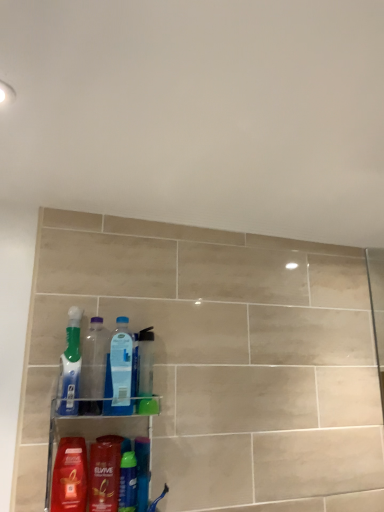
Describe the element at coordinates (119, 371) in the screenshot. I see `transparent plastic bottle at center, marked as the second bottle in a left-to-right arrangement` at that location.

Measure the distance between translucent plastic bottles at lower center and camera.

They are 1.09 meters apart.

This screenshot has width=384, height=512. What do you see at coordinates (70, 366) in the screenshot?
I see `translucent plastic toothbrush at left, positioned as the first cleaning product in top-to-bottom order` at bounding box center [70, 366].

What do you see at coordinates (70, 476) in the screenshot? The height and width of the screenshot is (512, 384). I see `shiny red shampoo at lower left, which appears as the second cleaning product when viewed from the top` at bounding box center [70, 476].

Measure the distance between translucent plastic mouthwash at lower center, placed as the second mouthwash when sorted from right to left, and camera.

A distance of 3.57 feet exists between translucent plastic mouthwash at lower center, placed as the second mouthwash when sorted from right to left, and camera.

Locate an element on the screen. The image size is (384, 512). translucent plastic bottle at lower center is located at coordinates (128, 482).

In the image, is shiny red shampoo at lower left, which appears as the second cleaning product when viewed from the top, positioned in front of or behind transparent plastic bottle at center, marked as the second bottle in a left-to-right arrangement?

shiny red shampoo at lower left, which appears as the second cleaning product when viewed from the top, is positioned closer to the viewer than transparent plastic bottle at center, marked as the second bottle in a left-to-right arrangement.

Considering the sizes of shiny red shampoo at lower left, which appears as the second cleaning product when viewed from the top, and transparent plastic bottle at center, positioned as the first bottle in right-to-left order, in the image, is shiny red shampoo at lower left, which appears as the second cleaning product when viewed from the top, wider or thinner than transparent plastic bottle at center, positioned as the first bottle in right-to-left order,?

Clearly, shiny red shampoo at lower left, which appears as the second cleaning product when viewed from the top, has more width compared to transparent plastic bottle at center, positioned as the first bottle in right-to-left order.

Considering the sizes of objects shiny red shampoo at lower left, which ranks as the first cleaning product in bottom-to-top order, and transparent plastic bottle at center, marked as the second bottle in a left-to-right arrangement, in the image provided, who is smaller, shiny red shampoo at lower left, which ranks as the first cleaning product in bottom-to-top order, or transparent plastic bottle at center, marked as the second bottle in a left-to-right arrangement,?

With smaller size is transparent plastic bottle at center, marked as the second bottle in a left-to-right arrangement.

Is shiny red shampoo at lower left, which appears as the second cleaning product when viewed from the top, oriented away from transparent plastic bottle at center, marked as the second bottle in a left-to-right arrangement?

No, shiny red shampoo at lower left, which appears as the second cleaning product when viewed from the top, is not facing away from transparent plastic bottle at center, marked as the second bottle in a left-to-right arrangement.

From the image's perspective, which is below, translucent plastic bottle at lower center or transparent plastic bottle at center, placed as the first bottle when sorted from left to right?

From the image's view, translucent plastic bottle at lower center is below.

Is translucent plastic bottle at lower center to the right of transparent plastic bottle at center, placed as the first bottle when sorted from left to right, from the viewer's perspective?

Yes, translucent plastic bottle at lower center is to the right of transparent plastic bottle at center, placed as the first bottle when sorted from left to right.

Considering the relative sizes of translucent plastic bottle at lower center and transparent plastic bottle at center, placed as the first bottle when sorted from left to right, in the image provided, is translucent plastic bottle at lower center shorter than transparent plastic bottle at center, placed as the first bottle when sorted from left to right,?

Yes.

From a real-world perspective, is translucent plastic bottle at lower center located higher than transparent plastic bottle at center, marked as the 2th bottle in a right-to-left arrangement?

Incorrect, from a real-world perspective, translucent plastic bottle at lower center is lower than transparent plastic bottle at center, marked as the 2th bottle in a right-to-left arrangement.

Is transparent plastic bottle at center, placed as the first bottle when sorted from left to right, not inside green plastic mouthwash at lower center, which appears as the 2th mouthwash when viewed from the left?

That's correct, transparent plastic bottle at center, placed as the first bottle when sorted from left to right, is outside of green plastic mouthwash at lower center, which appears as the 2th mouthwash when viewed from the left.

Can you confirm if transparent plastic bottle at center, placed as the first bottle when sorted from left to right, is positioned to the left of green plastic mouthwash at lower center, which appears as the 2th mouthwash when viewed from the left?

Indeed, transparent plastic bottle at center, placed as the first bottle when sorted from left to right, is positioned on the left side of green plastic mouthwash at lower center, which appears as the 2th mouthwash when viewed from the left.

From a real-world perspective, which object stands above the other?

transparent plastic bottle at center, placed as the first bottle when sorted from left to right.

What's the angular difference between shiny red shampoo at lower left, which ranks as the first cleaning product in bottom-to-top order, and translucent plastic toothbrush at left, positioned as the first cleaning product in top-to-bottom order,'s facing directions?

They differ by 0.000894 degrees in their facing directions.

Does shiny red shampoo at lower left, which ranks as the first cleaning product in bottom-to-top order, lie behind translucent plastic toothbrush at left, which is counted as the 2th cleaning product, starting from the bottom?

No, it is in front of translucent plastic toothbrush at left, which is counted as the 2th cleaning product, starting from the bottom.

Is shiny red shampoo at lower left, which ranks as the first cleaning product in bottom-to-top order, wider or thinner than translucent plastic toothbrush at left, which is counted as the 2th cleaning product, starting from the bottom?

In the image, shiny red shampoo at lower left, which ranks as the first cleaning product in bottom-to-top order, appears to be more narrow than translucent plastic toothbrush at left, which is counted as the 2th cleaning product, starting from the bottom.

From the image's perspective, is shiny red shampoo at lower left, which ranks as the first cleaning product in bottom-to-top order, positioned above or below translucent plastic toothbrush at left, positioned as the first cleaning product in top-to-bottom order?

shiny red shampoo at lower left, which ranks as the first cleaning product in bottom-to-top order, is below translucent plastic toothbrush at left, positioned as the first cleaning product in top-to-bottom order.

Based on the photo, is transparent plastic bottle at center, positioned as the first bottle in right-to-left order, with transparent plastic bottle at center, marked as the 2th bottle in a right-to-left arrangement?

Indeed, transparent plastic bottle at center, positioned as the first bottle in right-to-left order, and transparent plastic bottle at center, marked as the 2th bottle in a right-to-left arrangement, are beside each other and touching.

From a real-world perspective, is transparent plastic bottle at center, marked as the second bottle in a left-to-right arrangement, physically located above or below transparent plastic bottle at center, marked as the 2th bottle in a right-to-left arrangement?

From a real-world perspective, transparent plastic bottle at center, marked as the second bottle in a left-to-right arrangement, is physically below transparent plastic bottle at center, marked as the 2th bottle in a right-to-left arrangement.

Considering the sizes of transparent plastic bottle at center, positioned as the first bottle in right-to-left order, and transparent plastic bottle at center, placed as the first bottle when sorted from left to right, in the image, is transparent plastic bottle at center, positioned as the first bottle in right-to-left order, bigger or smaller than transparent plastic bottle at center, placed as the first bottle when sorted from left to right,?

transparent plastic bottle at center, positioned as the first bottle in right-to-left order, is bigger than transparent plastic bottle at center, placed as the first bottle when sorted from left to right.

Is transparent plastic bottle at center, positioned as the first bottle in right-to-left order, facing towards transparent plastic bottle at center, marked as the 2th bottle in a right-to-left arrangement?

No, transparent plastic bottle at center, positioned as the first bottle in right-to-left order, is not facing towards transparent plastic bottle at center, marked as the 2th bottle in a right-to-left arrangement.

Does green plastic mouthwash at lower center, which appears as the 2th mouthwash when viewed from the left, lie in front of transparent plastic bottle at center, marked as the 2th bottle in a right-to-left arrangement?

Yes, it is in front of transparent plastic bottle at center, marked as the 2th bottle in a right-to-left arrangement.

Is green plastic mouthwash at lower center, which appears as the 2th mouthwash when viewed from the left, turned away from transparent plastic bottle at center, placed as the first bottle when sorted from left to right?

No.

Is green plastic mouthwash at lower center, which appears as the 2th mouthwash when viewed from the left, with transparent plastic bottle at center, marked as the 2th bottle in a right-to-left arrangement?

They are not placed beside each other.

The width and height of the screenshot is (384, 512). Identify the location of bottle that is the 2nd object located above the green plastic mouthwash at lower center, which is counted as the 1th mouthwash, starting from the right (from the image's perspective). (93, 367).

This screenshot has height=512, width=384. Identify the location of the 1st cleaning product behind when counting from the translucent plastic bottles at lower center. (70, 476).

Which object is further away from the camera taking this photo, shiny red shampoo at lower left, which appears as the second cleaning product when viewed from the top, or translucent plastic bottles at lower center?

shiny red shampoo at lower left, which appears as the second cleaning product when viewed from the top, is more distant.

Are shiny red shampoo at lower left, which ranks as the first cleaning product in bottom-to-top order, and translucent plastic bottles at lower center located far from each other?

They are positioned close to each other.

In the scene shown: Is shiny red shampoo at lower left, which ranks as the first cleaning product in bottom-to-top order, inside the boundaries of translucent plastic bottles at lower center, or outside?

shiny red shampoo at lower left, which ranks as the first cleaning product in bottom-to-top order, is contained in translucent plastic bottles at lower center.

You are a GUI agent. You are given a task and a screenshot of the screen. Output one action in this format:
    pyautogui.click(x=<x>, y=<y>)
    Task: Click on the cleaning product that is under the transparent plastic bottle at center, positioned as the first bottle in right-to-left order (from a real-world perspective)
    The width and height of the screenshot is (384, 512).
    Given the screenshot: What is the action you would take?
    pyautogui.click(x=70, y=476)

Starting from the translucent plastic bottle at lower center, which bottle is the 2nd one behind? Please provide its 2D coordinates.

[(93, 367)]

When comparing their distances from shiny red shampoo at lower left, which appears as the second cleaning product when viewed from the top, does green plastic mouthwash at lower center, which appears as the 2th mouthwash when viewed from the left, or translucent plastic bottle at lower center seem further?

green plastic mouthwash at lower center, which appears as the 2th mouthwash when viewed from the left.

Looking at the image, which one is located closer to translucent plastic toothbrush at left, positioned as the first cleaning product in top-to-bottom order, shiny red shampoo at lower left, which ranks as the first cleaning product in bottom-to-top order, or transparent plastic bottle at center, marked as the second bottle in a left-to-right arrangement?

The object closer to translucent plastic toothbrush at left, positioned as the first cleaning product in top-to-bottom order, is transparent plastic bottle at center, marked as the second bottle in a left-to-right arrangement.

Looking at this image, considering their positions, is shiny red shampoo at lower left, which appears as the second cleaning product when viewed from the top, positioned further to translucent plastic bottles at lower center than translucent plastic toothbrush at left, which is counted as the 2th cleaning product, starting from the bottom?

translucent plastic toothbrush at left, which is counted as the 2th cleaning product, starting from the bottom, is further to translucent plastic bottles at lower center.

Based on their spatial positions, is translucent plastic mouthwash at lower center, the first mouthwash from the left, or translucent plastic bottles at lower center closer to green plastic mouthwash at lower center, which appears as the 2th mouthwash when viewed from the left?

translucent plastic mouthwash at lower center, the first mouthwash from the left, lies closer to green plastic mouthwash at lower center, which appears as the 2th mouthwash when viewed from the left, than the other object.

Based on their spatial positions, is shiny red shampoo at lower left, which ranks as the first cleaning product in bottom-to-top order, or translucent plastic mouthwash at lower center, placed as the second mouthwash when sorted from right to left, further from translucent plastic bottle at lower center?

shiny red shampoo at lower left, which ranks as the first cleaning product in bottom-to-top order, lies further to translucent plastic bottle at lower center than the other object.

Looking at the image, which one is located closer to shiny red shampoo at lower left, which ranks as the first cleaning product in bottom-to-top order, translucent plastic toothbrush at left, positioned as the first cleaning product in top-to-bottom order, or green plastic mouthwash at lower center, which appears as the 2th mouthwash when viewed from the left?

Based on the image, green plastic mouthwash at lower center, which appears as the 2th mouthwash when viewed from the left, appears to be nearer to shiny red shampoo at lower left, which ranks as the first cleaning product in bottom-to-top order.

Based on the photo, looking at the image, which one is located closer to green plastic mouthwash at lower center, which appears as the 2th mouthwash when viewed from the left, translucent plastic bottles at lower center or shiny red shampoo at lower left, which ranks as the first cleaning product in bottom-to-top order?

Based on the image, translucent plastic bottles at lower center appears to be nearer to green plastic mouthwash at lower center, which appears as the 2th mouthwash when viewed from the left.

Based on their spatial positions, is transparent plastic bottle at center, marked as the 2th bottle in a right-to-left arrangement, or translucent plastic mouthwash at lower center, placed as the second mouthwash when sorted from right to left, further from green plastic mouthwash at lower center, which appears as the 2th mouthwash when viewed from the left?

transparent plastic bottle at center, marked as the 2th bottle in a right-to-left arrangement.

The width and height of the screenshot is (384, 512). What are the coordinates of `mouthwash between transparent plastic bottle at center, marked as the 2th bottle in a right-to-left arrangement, and translucent plastic bottle at lower center in the up-down direction` in the screenshot? It's located at (105, 473).

What are the coordinates of `shelf between translucent plastic toothbrush at left, positioned as the first cleaning product in top-to-bottom order, and shiny red shampoo at lower left, which appears as the second cleaning product when viewed from the top, in the vertical direction` in the screenshot? It's located at (95, 458).

Find the location of `shelf between transparent plastic bottle at center, marked as the 2th bottle in a right-to-left arrangement, and translucent plastic mouthwash at lower center, the first mouthwash from the left, vertically`. shelf between transparent plastic bottle at center, marked as the 2th bottle in a right-to-left arrangement, and translucent plastic mouthwash at lower center, the first mouthwash from the left, vertically is located at coordinates pos(95,458).

Identify the location of mouthwash that lies between translucent plastic toothbrush at left, which is counted as the 2th cleaning product, starting from the bottom, and translucent plastic bottle at lower center from top to bottom. (105, 473).